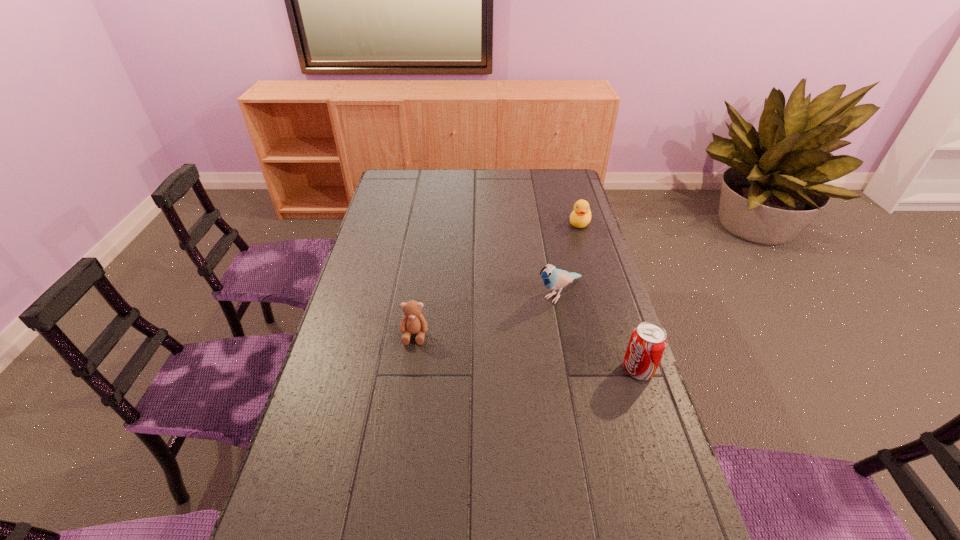
The width and height of the screenshot is (960, 540). I want to click on unoccupied area between the farthest object and the leftmost object, so click(497, 279).

This screenshot has height=540, width=960. What are the coordinates of `vacant area that lies between the soda and the leftmost object` in the screenshot? It's located at (526, 352).

Identify the location of free space between the third nearest object and the farthest object. Image resolution: width=960 pixels, height=540 pixels. (569, 258).

Find the location of a particular element. The height and width of the screenshot is (540, 960). vacant area that lies between the bird and the leftmost object is located at coordinates (487, 314).

Locate an element on the screen. vacant area between the duckling and the third object from right to left is located at coordinates (569, 258).

The width and height of the screenshot is (960, 540). I want to click on free space between the second nearest object and the soda, so click(526, 352).

Locate an element on the screen. The width and height of the screenshot is (960, 540). free space between the soda and the duckling is located at coordinates (609, 296).

The image size is (960, 540). Identify the location of free space that is in between the third farthest object and the second farthest object. (487, 314).

Identify the location of vacant area between the nearest object and the teddy bear. (526, 352).

The width and height of the screenshot is (960, 540). Find the location of `free space between the leftmost object and the second object from left to right`. free space between the leftmost object and the second object from left to right is located at coordinates (487, 314).